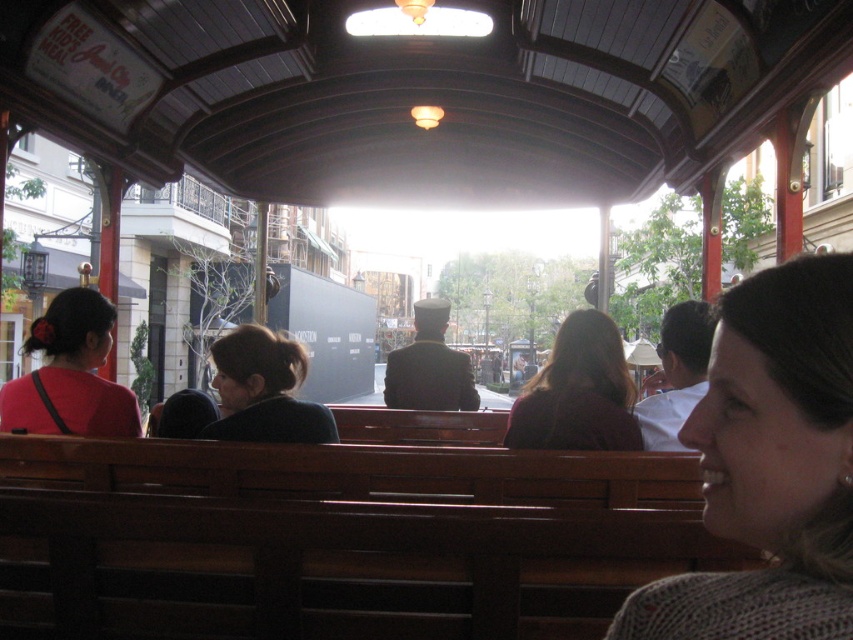
You are a photographer trying to capture a candid shot of the passengers in the vintage tram. You have a camera with a 30cm wide lens opening. The passengers are sitting on the wooden benches. Can you fit both the matte red shirt at left and the dark blue sweater at center into your lens frame at the same time?

The matte red shirt at left is wider than the dark blue sweater at center. Since the total width of both objects would exceed the 30cm lens opening, you cannot fit both into the frame simultaneously.

You are a photographer standing inside the vintage tram. You want to take a photo of both the gray knitted sweater at lower right and the dark blue sweater at center. Which sweater should you focus on first to ensure both are in clear view?

You should focus on the gray knitted sweater at lower right first because it is closer to the viewer, ensuring both it and the dark blue sweater at center will be in clear view.

You are a passenger on this vintage tram and want to know which of the two sweaters you see is taller. You see a gray knitted sweater at lower right and a dark blue sweater at center. Which one is taller?

A: The gray knitted sweater at lower right is taller than the dark blue sweater at center.